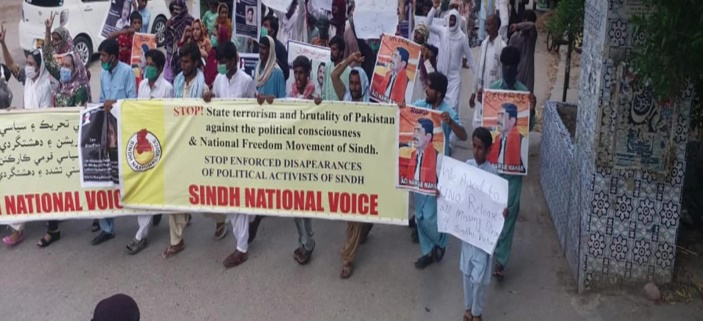
The width and height of the screenshot is (703, 321). Find the location of `pillar`. pillar is located at coordinates (607, 147).